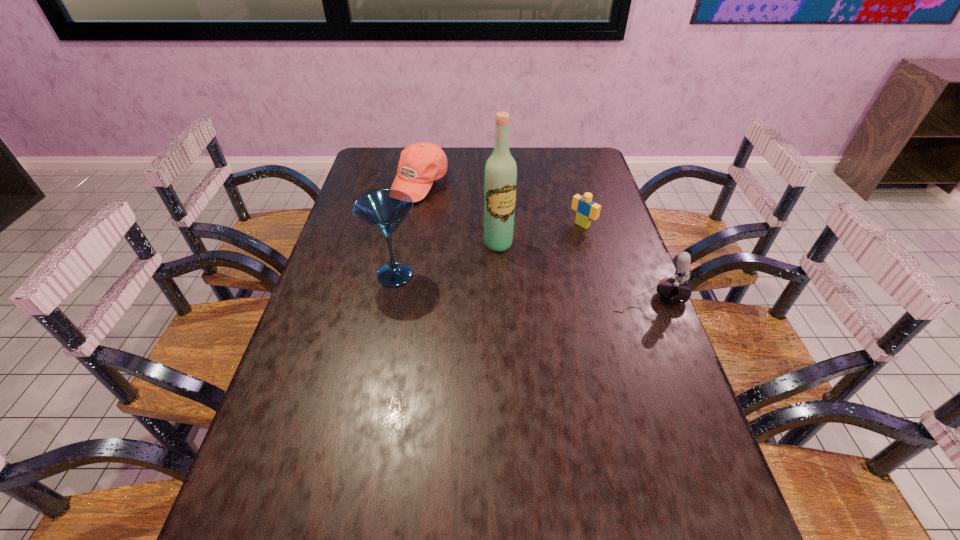
The image size is (960, 540). In the image, there is a desktop. In order to click on vacant space at the near right corner in this screenshot , I will do `click(703, 498)`.

Identify the location of vacant area that lies between the martini and the third object from left to right. (446, 259).

This screenshot has width=960, height=540. I want to click on free area in between the Lego and the martini, so click(489, 249).

What are the coordinates of `free spot between the microphone and the farthest object` in the screenshot? It's located at (534, 242).

This screenshot has width=960, height=540. I want to click on vacant space that's between the wine bottle and the baseball cap, so click(459, 214).

Find the location of a particular element. The image size is (960, 540). unoccupied area between the Lego and the martini is located at coordinates (489, 249).

Identify the location of free space between the shortest object and the microphone. The width and height of the screenshot is (960, 540). point(615,262).

Image resolution: width=960 pixels, height=540 pixels. In order to click on free space between the baseball cap and the martini in this screenshot , I will do `click(407, 230)`.

Locate an element on the screen. The image size is (960, 540). free space that is in between the second tallest object and the shortest object is located at coordinates (489, 249).

Locate which object is the closest to the shortest object. Please provide its 2D coordinates. Your answer should be formatted as a tuple, i.e. [(x, y)], where the tuple contains the x and y coordinates of a point satisfying the conditions above.

[(500, 178)]